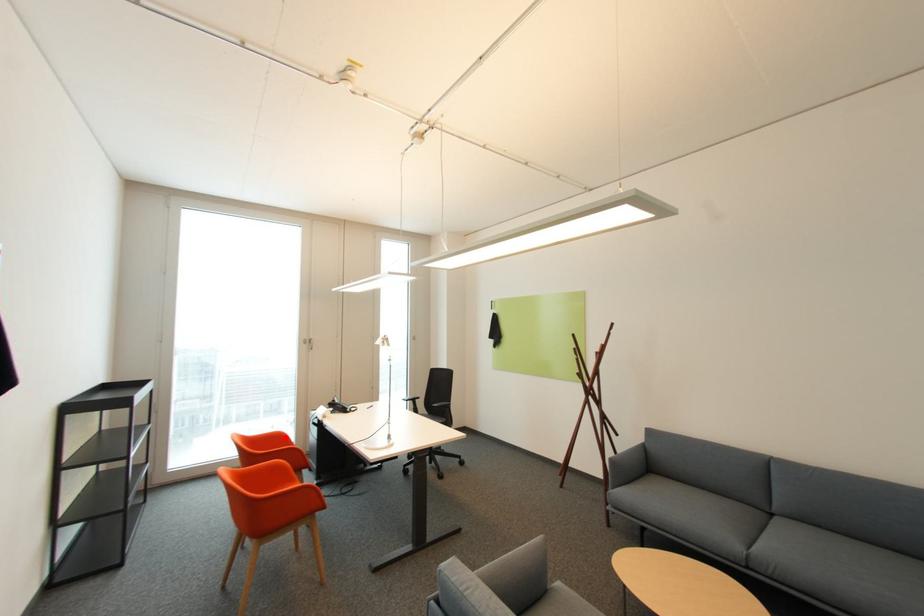
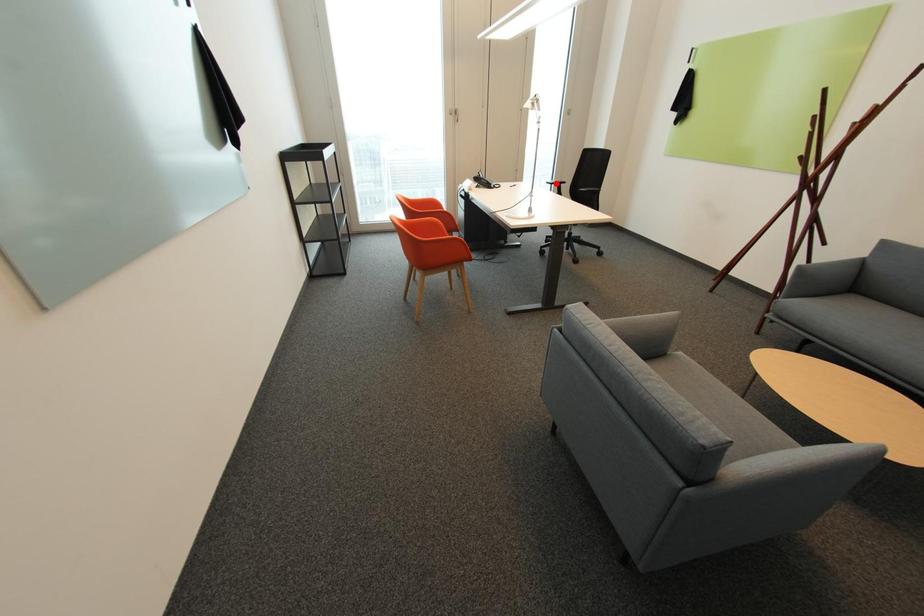
I am providing you with two images of the same scene from different viewpoints. A red point is marked on the first image and another point is marked on the second image. Are the points marked in image1 and image2 representing the same 3D position?

No